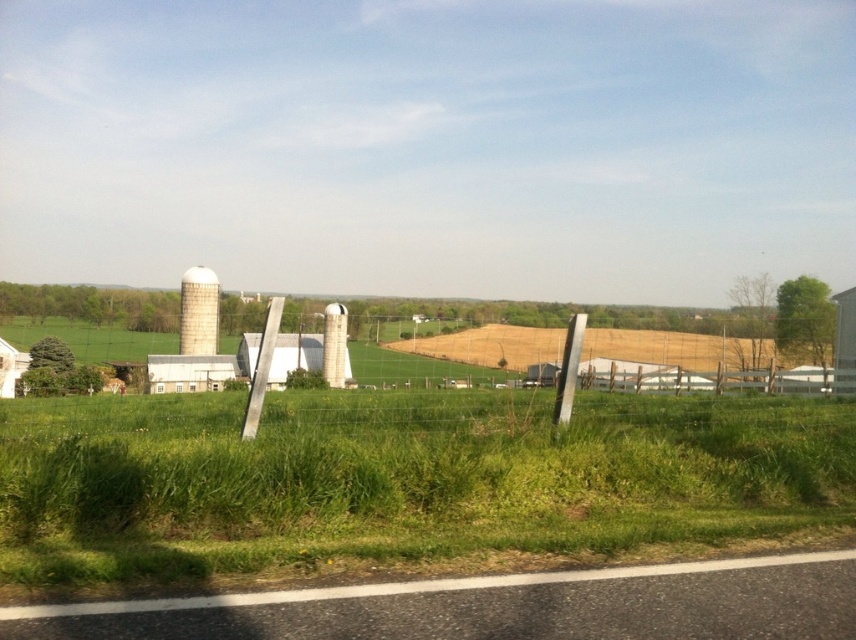
You are standing at the bottom of the image looking towards the silo. There are two points marked in the scene, point (473, 412) and point (212, 292). Which point is closer to you?

Point (473, 412) is closer to the camera than point (212, 292), so it is closer to you.

You are a farmer standing at the edge of the green grass at lower center. You want to reach the white matte silo at upper left. Is the silo taller than the grass where you are standing?

The green grass at lower center is shorter than the white matte silo at upper left, so yes, the silo is taller than the grass where you are standing.

You are standing at the bottom of the image and want to reach the silo in the midground. Which direction should you move relative to the green grass at lower center?

To reach the silo in the midground from the bottom of the image, you should move upward from the green grass at lower center since the silo is located in the midground, which is above the lower center area.